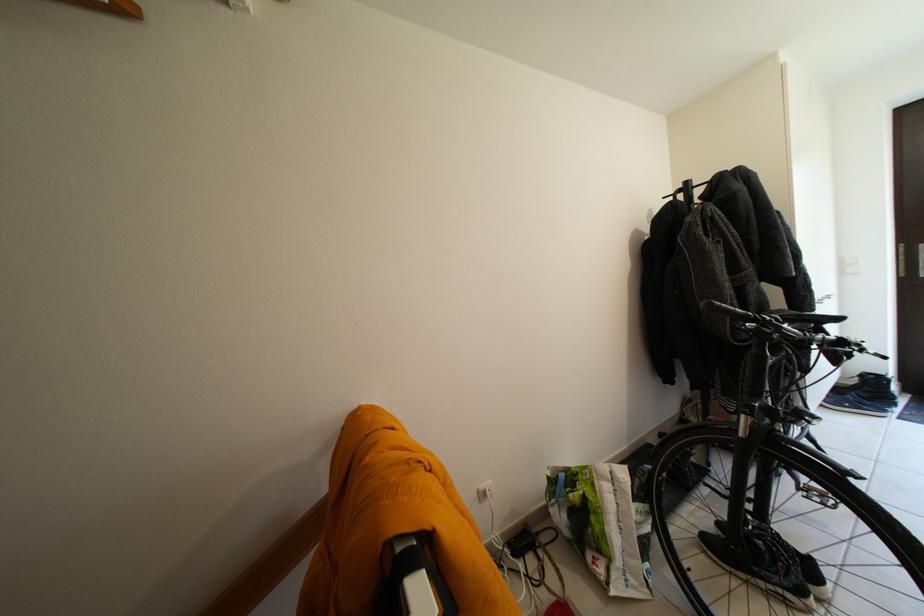
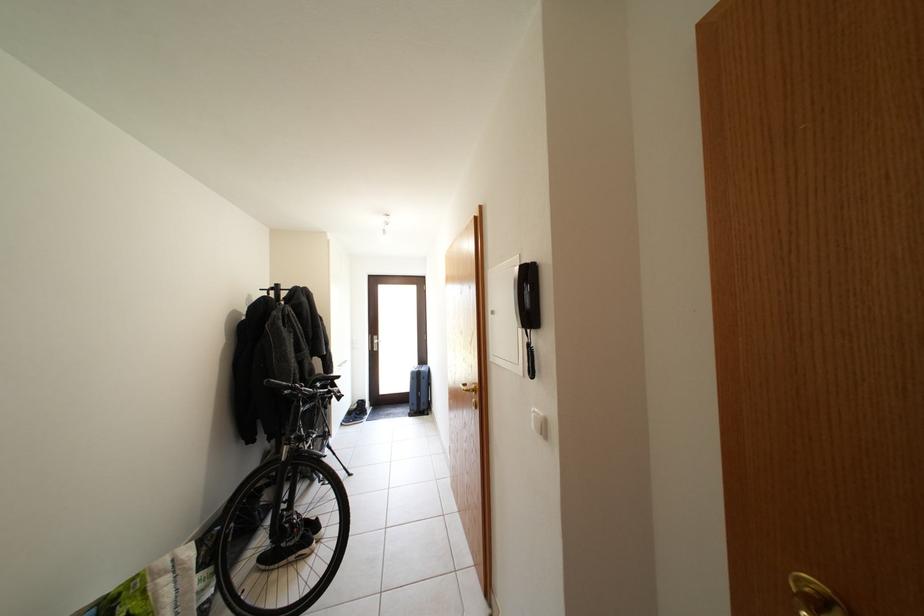
The point at (687, 197) is marked in the first image. Where is the corresponding point in the second image?

(281, 294)